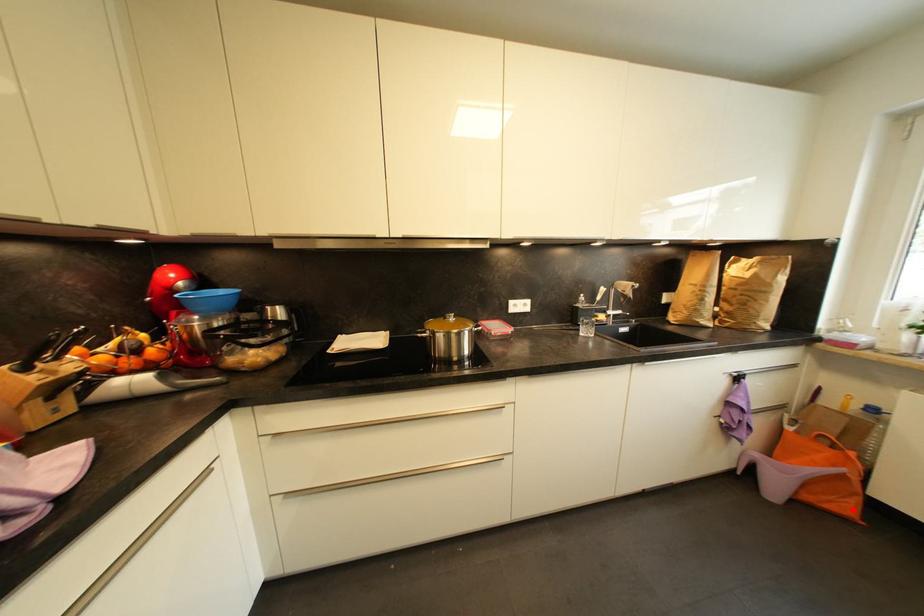
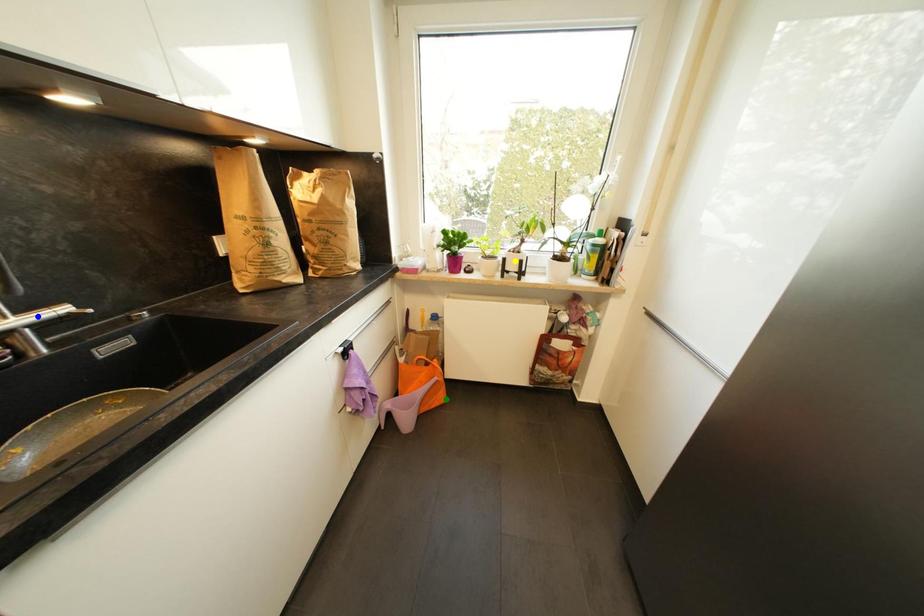
Question: I am providing you with two images of the same scene from different viewpoints. A red point is marked on the first image. You are given multiple points on the second image. Which spot in image 2 lines up with the point in image 1?

Choices:
 (A) blue point
 (B) green point
 (C) yellow point

Answer: (B)